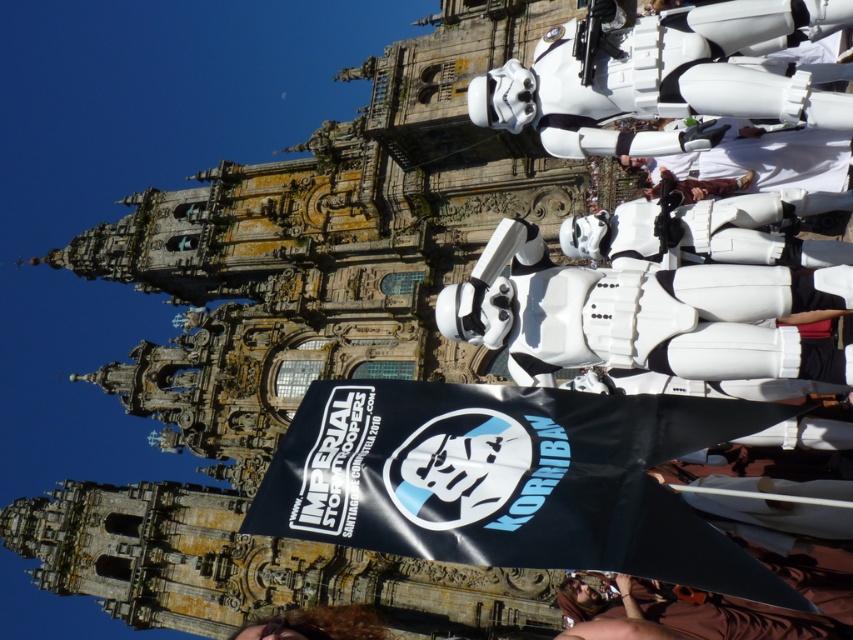
You are a photographer at the event and want to capture the black fabric flag at center and curly brown hair at lower center in the same frame. Which object is wider?

The black fabric flag at center is wider than curly brown hair at lower center.

You are a photographer at the event and want to capture a photo where both the black fabric flag at center and the curly brown hair at lower center are clearly visible. Given their sizes, which object should you focus on to ensure both are in frame without cropping?

The black fabric flag at center is bigger than curly brown hair at lower center, so you should focus on the black fabric flag at center to ensure both are in frame without cropping.

Based on the photo, you are a photographer trying to capture a group photo of the white matte stormtrooper at center and curly brown hair at lower center. If your camera has a maximum focus range of 70 feet, will you be able to capture both subjects clearly in the same photo?

The distance between the white matte stormtrooper at center and curly brown hair at lower center is 78.14 feet, which exceeds the camera maximum focus range of 70 feet. Therefore, you will not be able to capture both subjects clearly in the same photo.